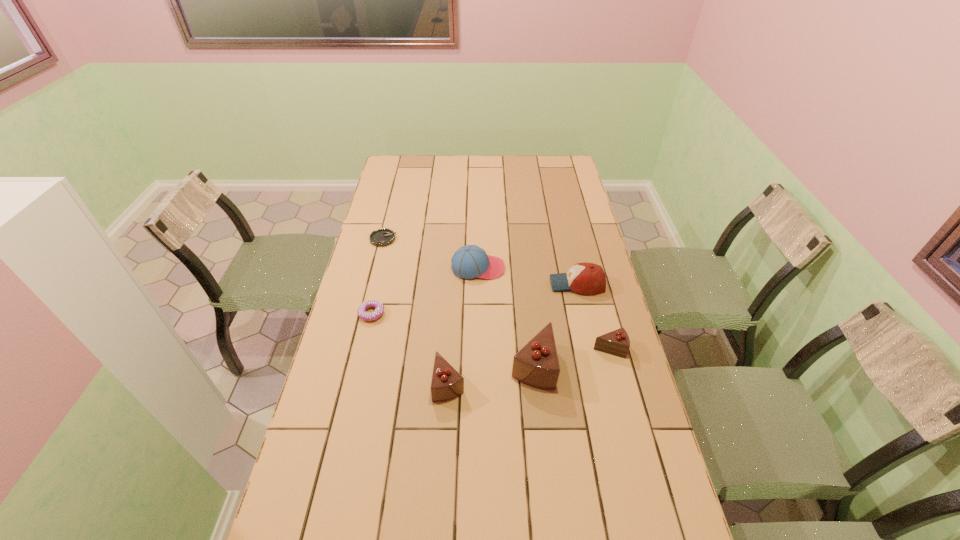
Please point a spot on the left to add another chocolate cake. Please provide its 2D coordinates. Your answer should be formatted as a tuple, i.e. [(x, y)], where the tuple contains the x and y coordinates of a point satisfying the conditions above.

[(360, 403)]